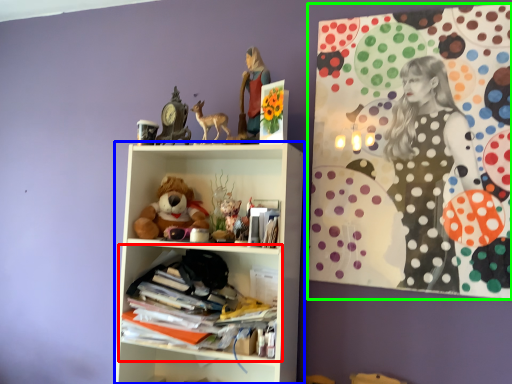
Question: Which is nearer to the shelf (highlighted by a red box)? shelf (highlighted by a blue box) or bulletin board (highlighted by a green box).

Choices:
 (A) shelf
 (B) bulletin board

Answer: (A)